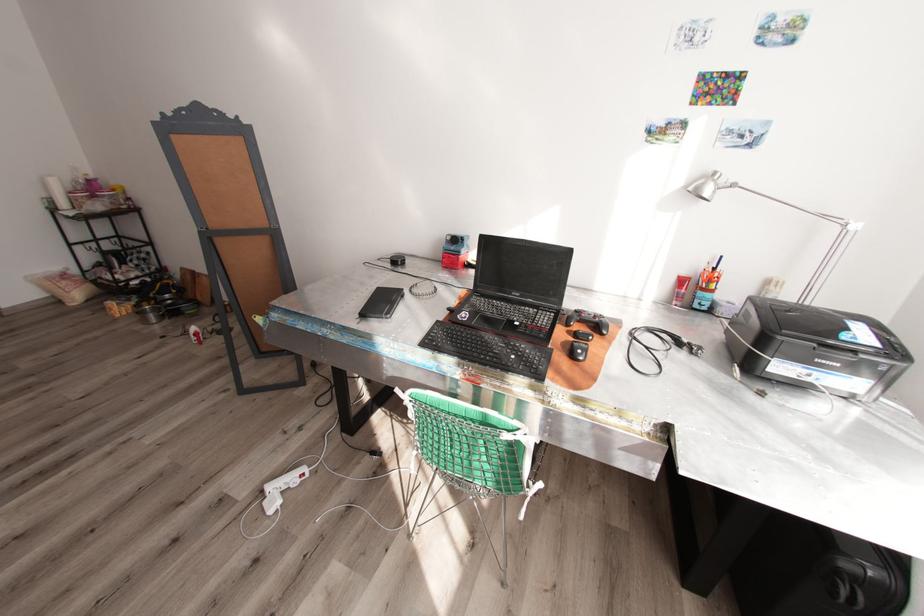
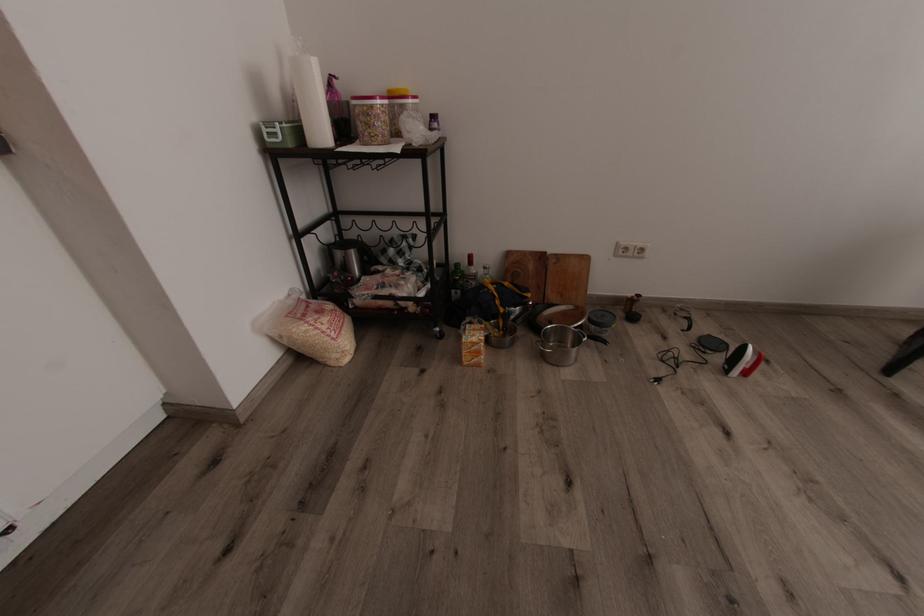
What movement of the cameraman would produce the second image?

The cameraman moved toward left, forward.